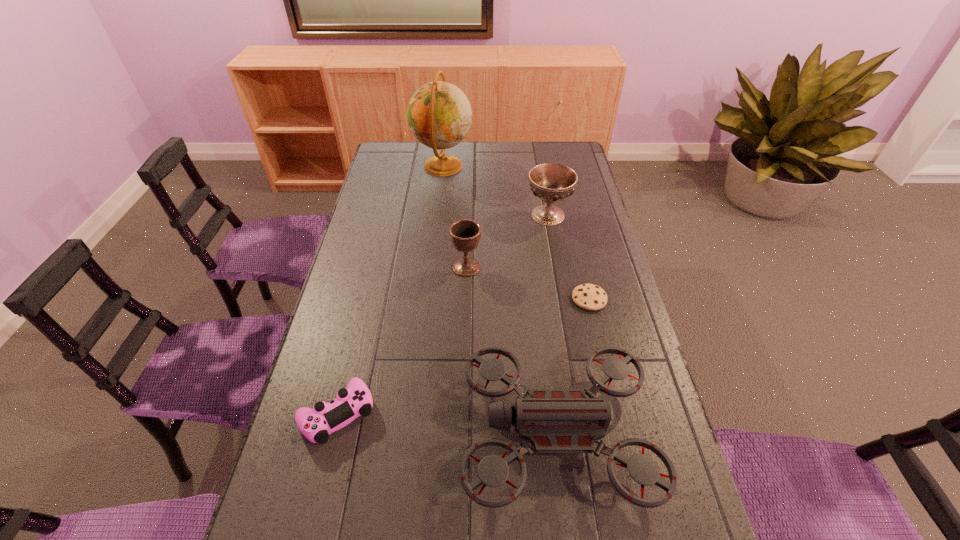
Image resolution: width=960 pixels, height=540 pixels. I want to click on empty space that is in between the farthest object and the farther chalice, so click(x=495, y=191).

This screenshot has width=960, height=540. I want to click on empty space between the tallest object and the nearer chalice, so click(455, 217).

This screenshot has height=540, width=960. I want to click on vacant space that is in between the third farthest object and the right chalice, so click(507, 241).

Identify the location of free point between the nearer chalice and the drone. (511, 349).

The height and width of the screenshot is (540, 960). In order to click on blank region between the second shortest object and the fourth farthest object in this screenshot , I will do `click(463, 356)`.

The height and width of the screenshot is (540, 960). I want to click on vacant region between the farther chalice and the cookie, so click(568, 257).

I want to click on vacant region between the shortest object and the control, so click(x=463, y=356).

Image resolution: width=960 pixels, height=540 pixels. In order to click on vacant space that's between the third nearest object and the fourth tallest object in this screenshot , I will do `click(572, 366)`.

Where is `object that can be found as the closest to the tallest object`? This screenshot has width=960, height=540. object that can be found as the closest to the tallest object is located at coordinates (551, 182).

Find the location of `object that can be found as the fifth closest to the farther chalice`. object that can be found as the fifth closest to the farther chalice is located at coordinates (316, 424).